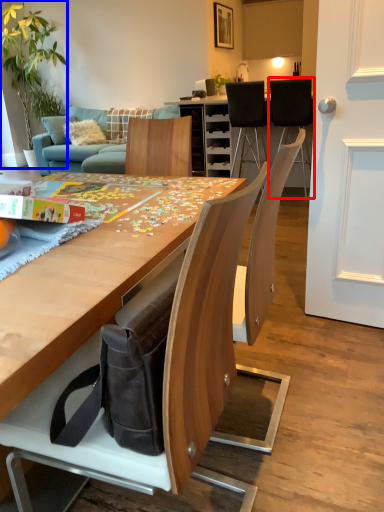
Question: Which object is closer to the camera taking this photo, chair (highlighted by a red box) or houseplant (highlighted by a blue box)?

Choices:
 (A) chair
 (B) houseplant

Answer: (A)